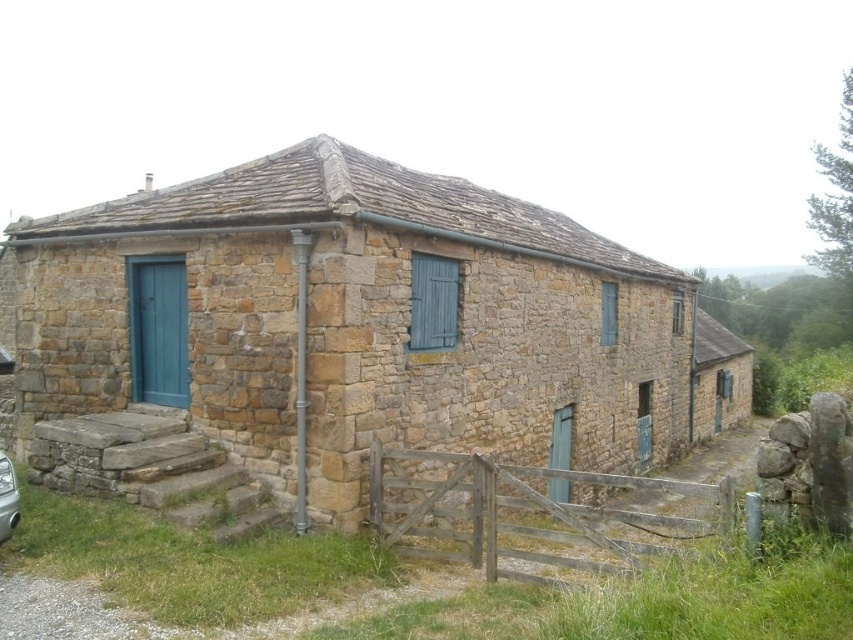
Question: Which point is farther from the camera taking this photo?

Choices:
 (A) (1, 492)
 (B) (287, 250)

Answer: (B)

Question: Is rustic stone cottage at center below silver metallic car at lower left?

Choices:
 (A) yes
 (B) no

Answer: (B)

Question: Does rustic stone cottage at center appear over silver metallic car at lower left?

Choices:
 (A) no
 (B) yes

Answer: (B)

Question: Is rustic stone cottage at center positioned behind silver metallic car at lower left?

Choices:
 (A) yes
 (B) no

Answer: (A)

Question: Which object is farther from the camera taking this photo?

Choices:
 (A) rustic stone cottage at center
 (B) silver metallic car at lower left

Answer: (A)